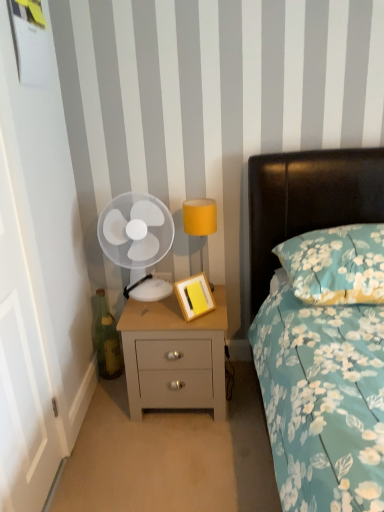
Where is `free location to the left of wooden picture frame at center`? This screenshot has width=384, height=512. free location to the left of wooden picture frame at center is located at coordinates (152, 324).